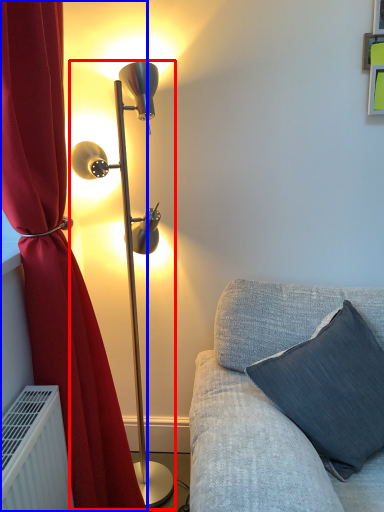
Question: Among these objects, which one is nearest to the camera, lamp (highlighted by a red box) or curtain (highlighted by a blue box)?

Choices:
 (A) lamp
 (B) curtain

Answer: (B)